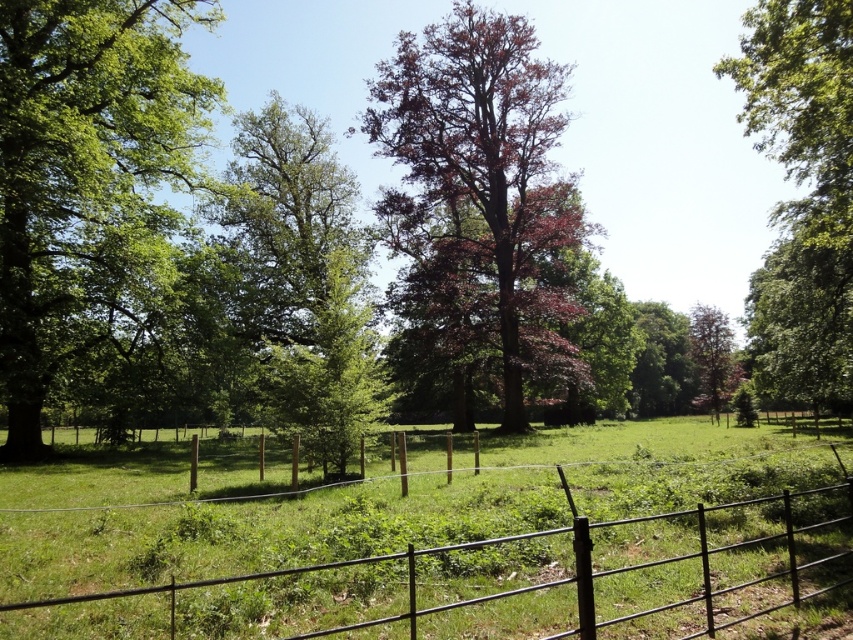
Consider the image. You are a painter setting up your easel in the field and want to capture the scene. You notice the black metal fence at lower center and the green leafy tree at left. Which object is taller?

The green leafy tree at left is taller than the black metal fence at lower center according to the description.